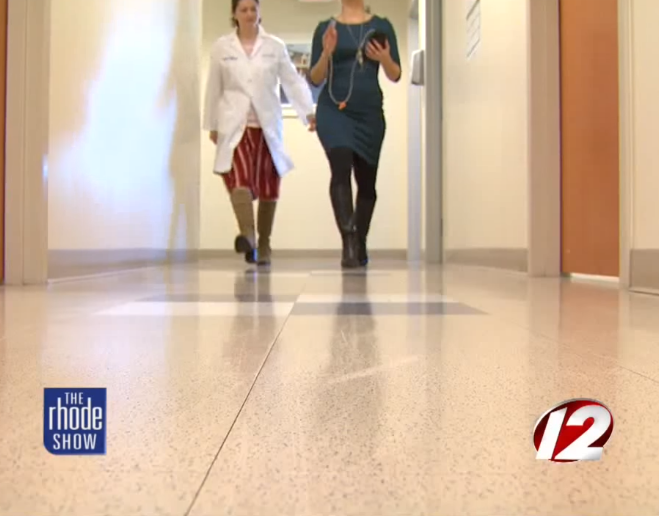
This screenshot has width=659, height=516. I want to click on door frames, so click(28, 120), click(540, 87), click(426, 86), click(625, 120).